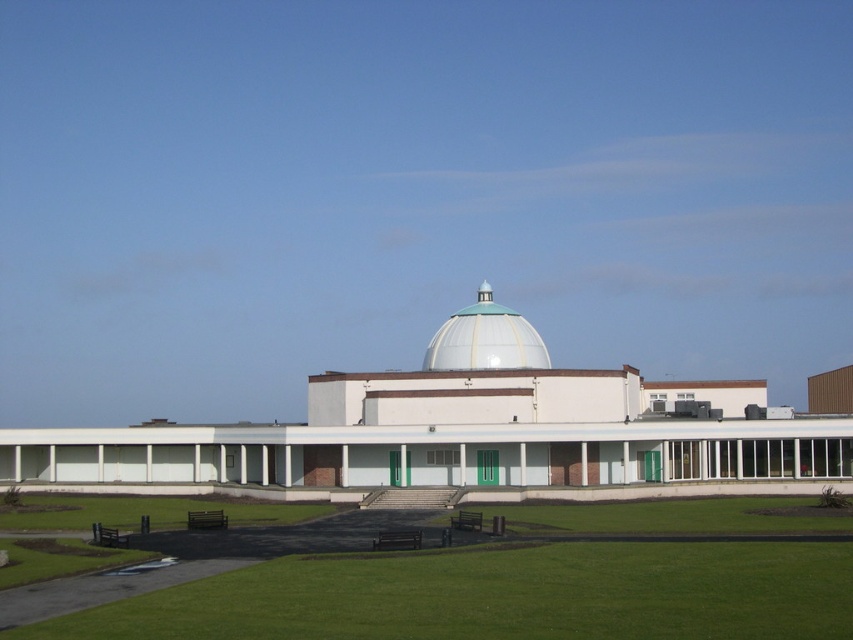
Question: Which point appears farthest from the camera in this image?

Choices:
 (A) (611, 563)
 (B) (518, 342)

Answer: (B)

Question: Among these points, which one is nearest to the camera?

Choices:
 (A) (531, 576)
 (B) (473, 307)

Answer: (A)

Question: In this image, where is green grass at lower center located relative to white glossy dome at center?

Choices:
 (A) right
 (B) left

Answer: (A)

Question: Can you confirm if green grass at lower center is bigger than white glossy dome at center?

Choices:
 (A) no
 (B) yes

Answer: (A)

Question: Considering the relative positions of green grass at lower center and white glossy dome at center in the image provided, where is green grass at lower center located with respect to white glossy dome at center?

Choices:
 (A) above
 (B) below

Answer: (B)